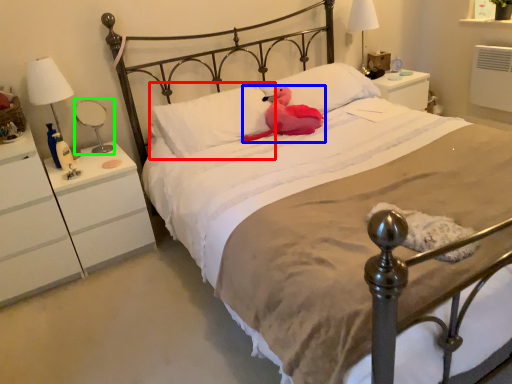
Question: Estimate the real-world distances between objects in this image. Which object is farther from pillow (highlighted by a red box), animal (highlighted by a blue box) or bedside lamp (highlighted by a green box)?

Choices:
 (A) animal
 (B) bedside lamp

Answer: (B)